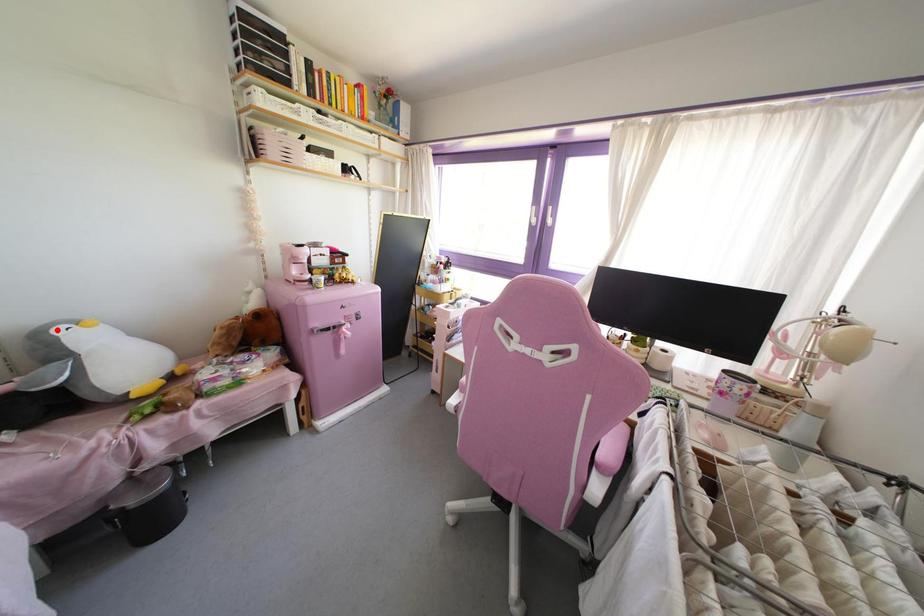
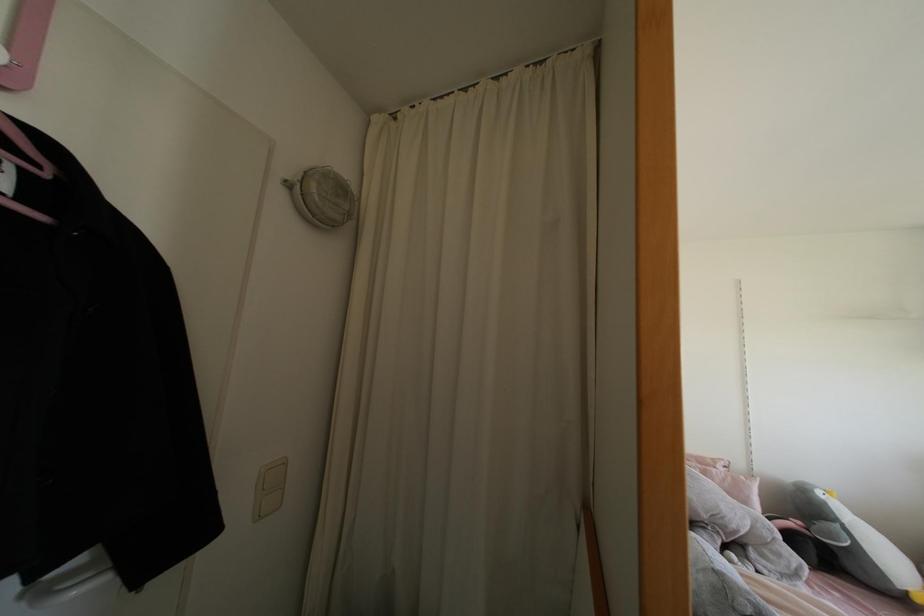
Question: I am providing you with two images of the same scene from different viewpoints. In image1, a red point is highlighted. Considering the same 3D point in image2, which of the following is correct?

Choices:
 (A) It is closer
 (B) It is farther

Answer: (A)